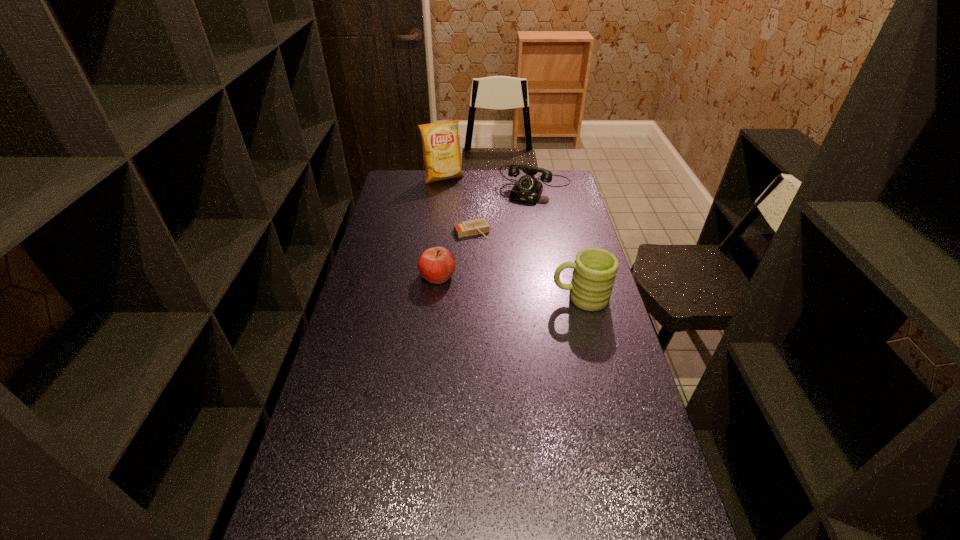
This screenshot has height=540, width=960. In order to click on vacant space on the desktop that is between the apple and the mug and is positioned on the striking surface of the third farthest object in this screenshot , I will do `click(503, 286)`.

This screenshot has width=960, height=540. I want to click on vacant space on the desktop that is between the apple and the fourth shortest object and is positioned on the front-facing side of the crisp (potato chip), so click(x=514, y=288).

At what (x,y) coordinates should I click in order to perform the action: click on vacant spot on the desktop that is between the apple and the fourth shortest object and is positioned on the front-facing side of the telephone. Please return your answer as a coordinate pair (x, y). Looking at the image, I should click on (487, 284).